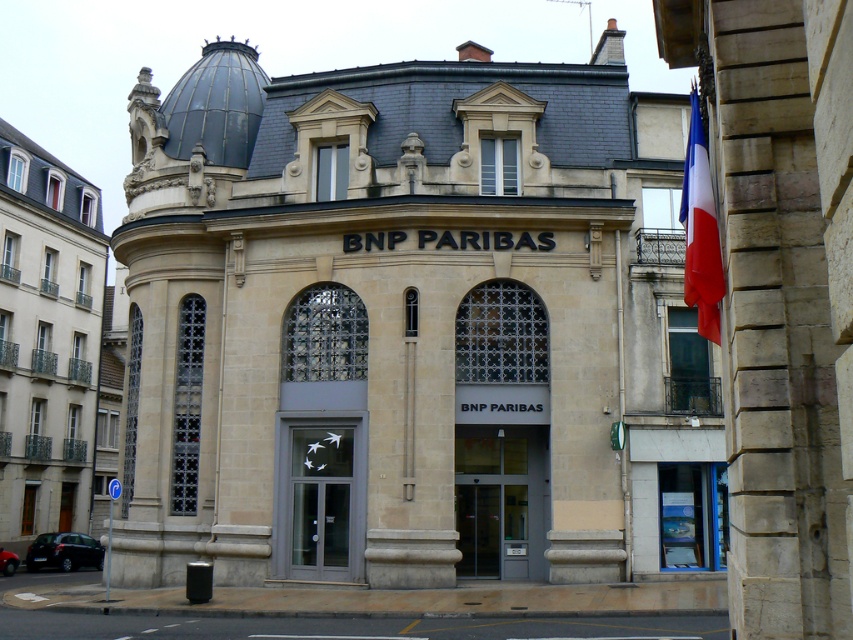
You are a delivery person trying to enter the BNP Paribas bank branch. You see two doors at the center of the entrance area. The transparent glass door at center and the matte gray door at center. Which door is more likely to be the main entrance for deliveries?

The transparent glass door at center is thinner than the matte gray door at center, so the matte gray door at center is more likely to be the main entrance for deliveries since thicker doors are typically used for main entrances to provide better security and durability.